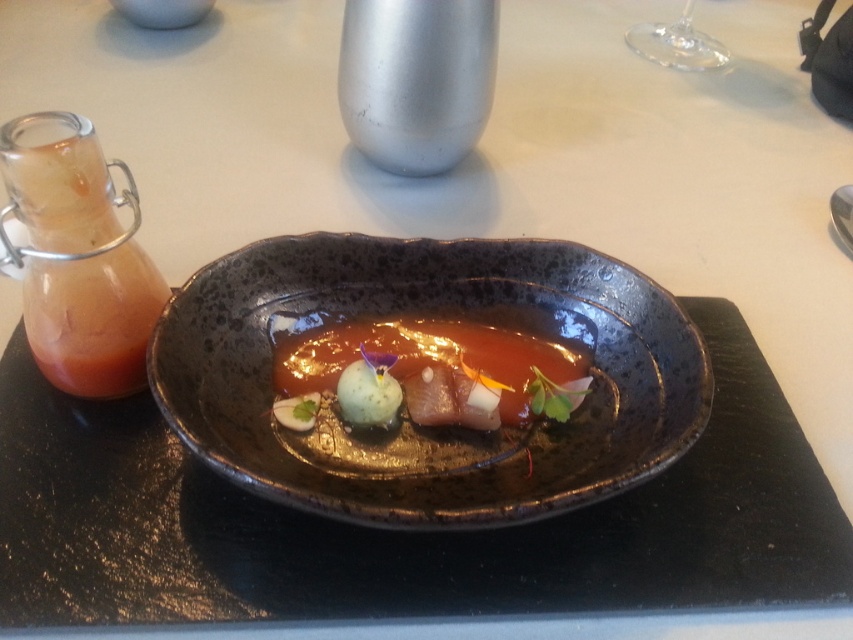
Is point (48, 122) closer to viewer compared to point (556, 349)?

Yes.

What do you see at coordinates (77, 257) in the screenshot?
I see `translucent glass bottle at left` at bounding box center [77, 257].

Does point (65, 292) come in front of point (340, 344)?

Yes, it is.

Identify the location of translucent glass bottle at left. The image size is (853, 640). (77, 257).

Looking at this image, between speckled ceramic platter at center and translucent glass bottle at left, which one has more height?

translucent glass bottle at left is taller.

Does speckled ceramic platter at center appear on the right side of translucent glass bottle at left?

Indeed, speckled ceramic platter at center is positioned on the right side of translucent glass bottle at left.

Is point (405, 508) less distant than point (113, 330)?

Yes, point (405, 508) is closer to viewer.

You are a GUI agent. You are given a task and a screenshot of the screen. Output one action in this format:
    pyautogui.click(x=<x>, y=<y>)
    Task: Click on the speckled ceramic platter at center
    This screenshot has width=853, height=640.
    Given the screenshot: What is the action you would take?
    pyautogui.click(x=410, y=420)

Is speckled ceramic platter at center positioned in front of glossy ceramic plate at center?

Yes, speckled ceramic platter at center is closer to the viewer.

Does speckled ceramic platter at center have a greater width compared to glossy ceramic plate at center?

Indeed, speckled ceramic platter at center has a greater width compared to glossy ceramic plate at center.

Is point (561, 500) positioned after point (482, 308)?

No, (561, 500) is in front of (482, 308).

Locate an element on the screen. This screenshot has height=640, width=853. speckled ceramic platter at center is located at coordinates (410, 420).